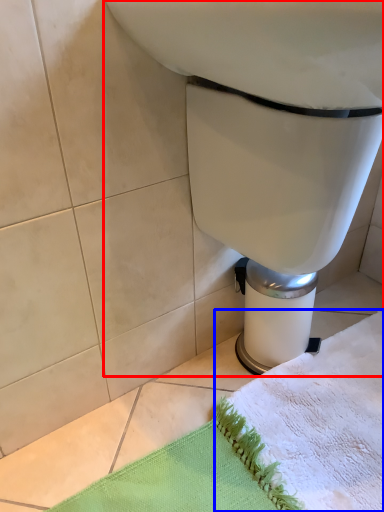
Question: Among these objects, which one is nearest to the camera, toilet (highlighted by a red box) or bath towel (highlighted by a blue box)?

Choices:
 (A) toilet
 (B) bath towel

Answer: (A)